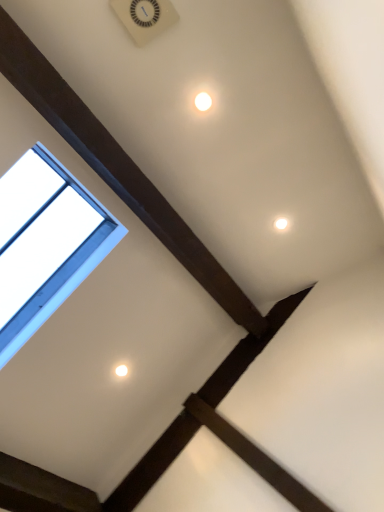
What are the coordinates of `transparent glass window at upper left` in the screenshot? It's located at (45, 244).

The height and width of the screenshot is (512, 384). Describe the element at coordinates (45, 244) in the screenshot. I see `transparent glass window at upper left` at that location.

What do you see at coordinates (202, 100) in the screenshot?
I see `white glossy light at upper center` at bounding box center [202, 100].

In order to face white glossy light at upper center, should I rotate leftwards or rightwards?

A 1.213 degree turn to the right will do.

At what (x,y) coordinates should I click in order to perform the action: click on white glossy light at upper center. Please return your answer as a coordinate pair (x, y). The height and width of the screenshot is (512, 384). Looking at the image, I should click on (202, 100).

The width and height of the screenshot is (384, 512). Find the location of `transparent glass window at upper left`. transparent glass window at upper left is located at coordinates (45, 244).

Considering the relative positions of transparent glass window at upper left and white glossy light at upper center in the image provided, is transparent glass window at upper left to the right of white glossy light at upper center from the viewer's perspective?

No.

Considering the positions of objects transparent glass window at upper left and white glossy light at upper center in the image provided, who is in front, transparent glass window at upper left or white glossy light at upper center?

transparent glass window at upper left.

Is point (17, 192) positioned after point (214, 103)?

That is True.

From the image's perspective, relative to white glossy light at upper center, is transparent glass window at upper left above or below?

transparent glass window at upper left is situated lower than white glossy light at upper center in the image.

From a real-world perspective, does transparent glass window at upper left sit lower than white glossy light at upper center?

Yes, from a real-world perspective, transparent glass window at upper left is below white glossy light at upper center.

Is transparent glass window at upper left wider or thinner than white glossy light at upper center?

In the image, transparent glass window at upper left appears to be wider than white glossy light at upper center.

Considering the sizes of objects transparent glass window at upper left and white glossy light at upper center in the image provided, who is taller, transparent glass window at upper left or white glossy light at upper center?

transparent glass window at upper left.

Who is smaller, transparent glass window at upper left or white glossy light at upper center?

white glossy light at upper center is smaller.

Is transparent glass window at upper left spatially inside white glossy light at upper center, or outside of it?

The correct answer is: outside.

Are transparent glass window at upper left and white glossy light at upper center far apart?

transparent glass window at upper left is positioned a significant distance from white glossy light at upper center.

Is transparent glass window at upper left oriented away from white glossy light at upper center?

No.

Can you tell me how much transparent glass window at upper left and white glossy light at upper center differ in facing direction?

There is a 177-degree angle between the facing directions of transparent glass window at upper left and white glossy light at upper center.

How much distance is there between transparent glass window at upper left and white glossy light at upper center?

transparent glass window at upper left is 1.11 meters from white glossy light at upper center.

The image size is (384, 512). I want to click on window lying on the left of white glossy light at upper center, so click(45, 244).

Is white glossy light at upper center to the right of transparent glass window at upper left from the viewer's perspective?

Indeed, white glossy light at upper center is positioned on the right side of transparent glass window at upper left.

Is white glossy light at upper center in front of or behind transparent glass window at upper left in the image?

white glossy light at upper center is behind transparent glass window at upper left.

Considering the points (215, 106) and (38, 226), which point is in front, point (215, 106) or point (38, 226)?

The point (215, 106) is in front.

From the image's perspective, which is below, white glossy light at upper center or transparent glass window at upper left?

transparent glass window at upper left appears lower in the image.

From a real-world perspective, which is physically below, white glossy light at upper center or transparent glass window at upper left?

transparent glass window at upper left, from a real-world perspective.

Is white glossy light at upper center wider than transparent glass window at upper left?

Incorrect, the width of white glossy light at upper center does not surpass that of transparent glass window at upper left.

Considering the sizes of objects white glossy light at upper center and transparent glass window at upper left in the image provided, who is taller, white glossy light at upper center or transparent glass window at upper left?

transparent glass window at upper left.

Who is bigger, white glossy light at upper center or transparent glass window at upper left?

transparent glass window at upper left.

Is white glossy light at upper center not within transparent glass window at upper left?

Yes, white glossy light at upper center is not within transparent glass window at upper left.

Are white glossy light at upper center and transparent glass window at upper left far apart?

Yes.

Is white glossy light at upper center looking in the opposite direction of transparent glass window at upper left?

No, white glossy light at upper center is not facing away from transparent glass window at upper left.

Measure the distance between white glossy light at upper center and transparent glass window at upper left.

They are 1.11 meters apart.

Find the location of a particular element. dot above the transparent glass window at upper left (from the image's perspective) is located at coordinates (202, 100).

You are a GUI agent. You are given a task and a screenshot of the screen. Output one action in this format:
    pyautogui.click(x=<x>, y=<y>)
    Task: Click on the window in front of the white glossy light at upper center
    
    Given the screenshot: What is the action you would take?
    pyautogui.click(x=45, y=244)

Identify the location of dot located above the transparent glass window at upper left (from the image's perspective). (202, 100).